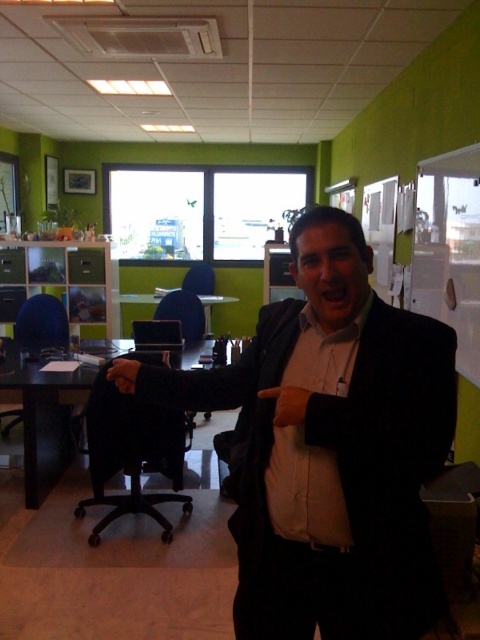
Question: Can you confirm if black plastic swivel chair at center is positioned above leather glove at center?

Choices:
 (A) yes
 (B) no

Answer: (B)

Question: Does black matte suit at center appear over matte black hand at lower left?

Choices:
 (A) yes
 (B) no

Answer: (B)

Question: Which object appears closest to the camera in this image?

Choices:
 (A) black matte suit at center
 (B) black plastic swivel chair at center
 (C) leather glove at center
 (D) matte black hand at lower left

Answer: (A)

Question: Can you confirm if black plastic swivel chair at center is bigger than matte black hand at lower left?

Choices:
 (A) yes
 (B) no

Answer: (A)

Question: Which is nearer to the leather glove at center?

Choices:
 (A) black matte suit at center
 (B) matte black hand at lower left
 (C) black plastic swivel chair at center

Answer: (A)

Question: Which of the following is the closest to the observer?

Choices:
 (A) black matte suit at center
 (B) matte black hand at lower left
 (C) leather glove at center
 (D) black plastic swivel chair at center

Answer: (A)